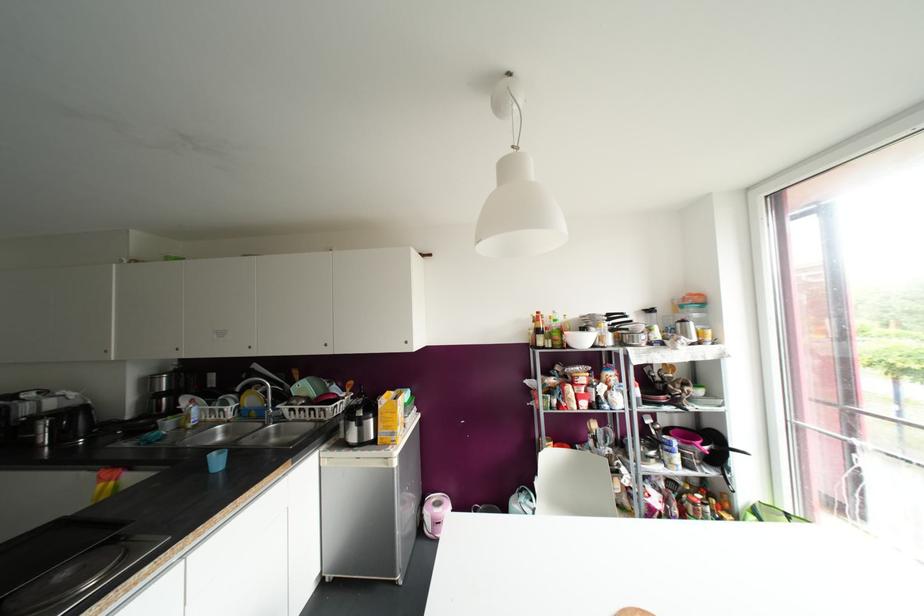
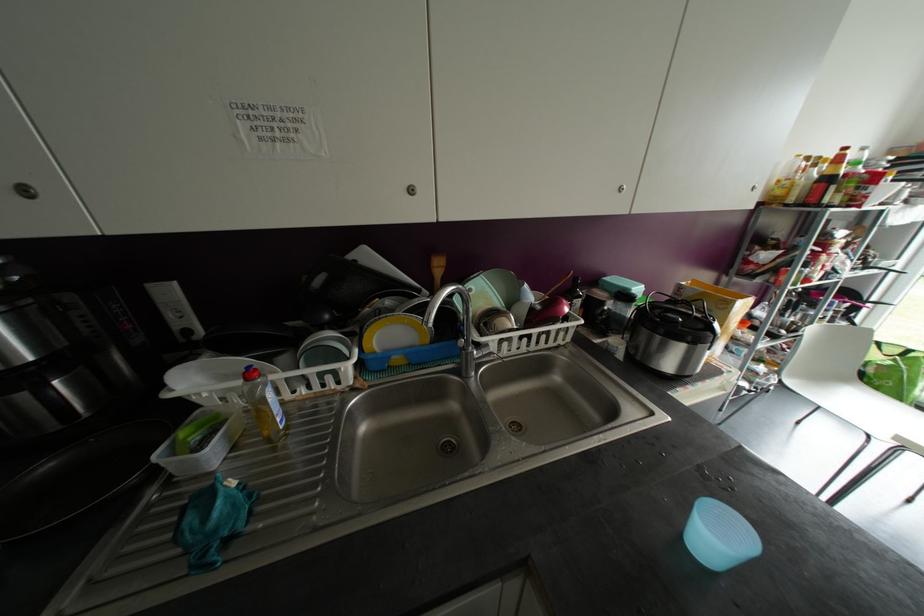
Locate, in the second image, the point that corresponds to point 195,426 in the first image.

(286, 427)